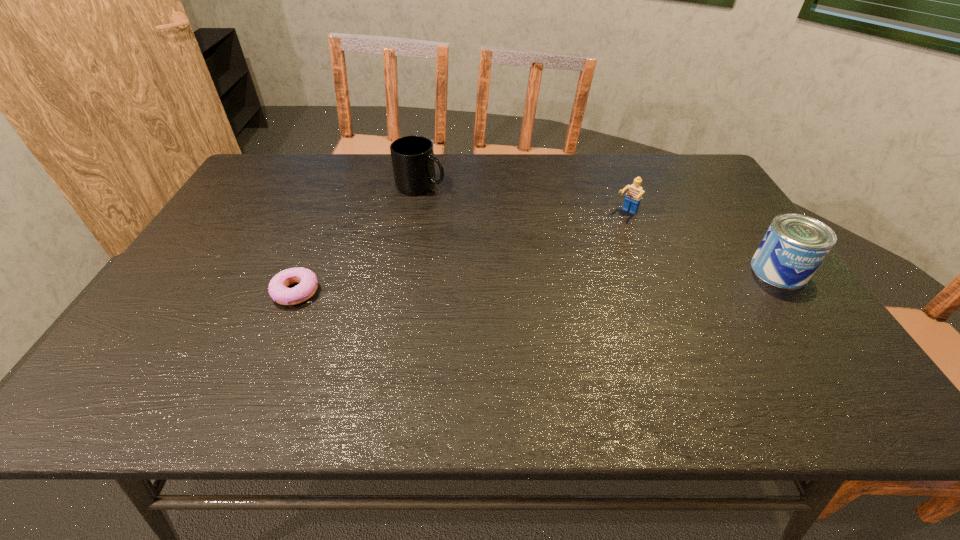
Where is `free region at the near right corner of the desktop`? This screenshot has height=540, width=960. free region at the near right corner of the desktop is located at coordinates tap(820, 346).

Locate an element on the screen. vacant area that lies between the second farthest object and the can is located at coordinates (703, 242).

Where is `vacant area between the leftmost object and the Lego`? The width and height of the screenshot is (960, 540). vacant area between the leftmost object and the Lego is located at coordinates (461, 253).

Locate an element on the screen. Image resolution: width=960 pixels, height=540 pixels. free spot between the mug and the second shortest object is located at coordinates (523, 199).

You are a GUI agent. You are given a task and a screenshot of the screen. Output one action in this format:
    pyautogui.click(x=<x>, y=<y>)
    Task: Click on the free space between the rightmost object and the leftmost object
    This screenshot has height=540, width=960.
    Given the screenshot: What is the action you would take?
    pyautogui.click(x=538, y=281)

Locate an element on the screen. Image resolution: width=960 pixels, height=540 pixels. vacant space that's between the Lego and the doughnut is located at coordinates (461, 253).

The width and height of the screenshot is (960, 540). I want to click on free space between the third object from right to left and the second shortest object, so coord(523,199).

Identify the location of vacant space that's between the leftmost object and the can. (538, 281).

Identify the location of blank region between the shortest object and the third object from right to left. The width and height of the screenshot is (960, 540). (358, 238).

At what (x,y) coordinates should I click in order to perform the action: click on vacant region between the third tallest object and the shortest object. Please return your answer as a coordinate pair (x, y). Image resolution: width=960 pixels, height=540 pixels. Looking at the image, I should click on (461, 253).